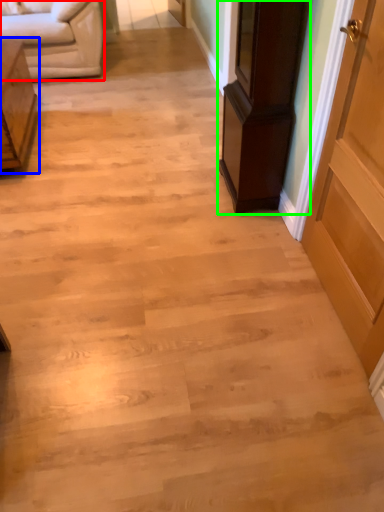
Question: Considering the real-world distances, which object is closest to studio couch (highlighted by a red box)? furniture (highlighted by a blue box) or furniture (highlighted by a green box).

Choices:
 (A) furniture
 (B) furniture

Answer: (A)